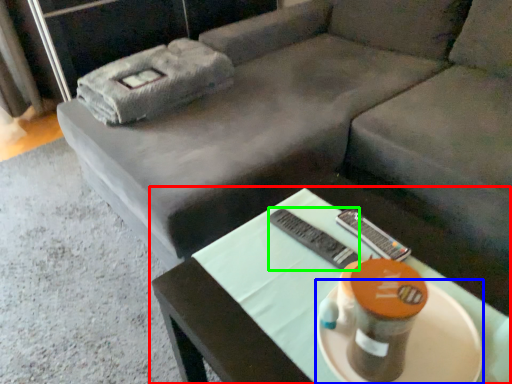
Question: Estimate the real-world distances between objects in this image. Which object is closer to table (highlighted by a red box), platter (highlighted by a blue box) or remote (highlighted by a green box)?

Choices:
 (A) platter
 (B) remote

Answer: (B)